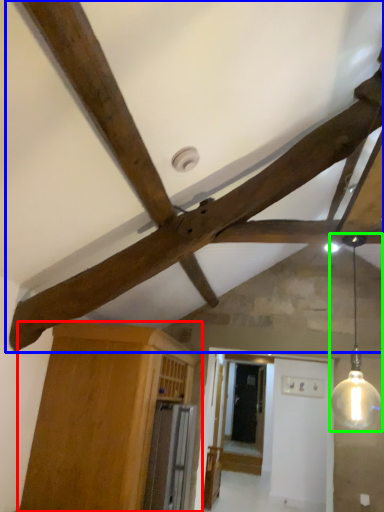
Question: Estimate the real-world distances between objects in this image. Which object is farther from cabinetry (highlighted by a red box), fan (highlighted by a blue box) or light fixture (highlighted by a green box)?

Choices:
 (A) fan
 (B) light fixture

Answer: (B)